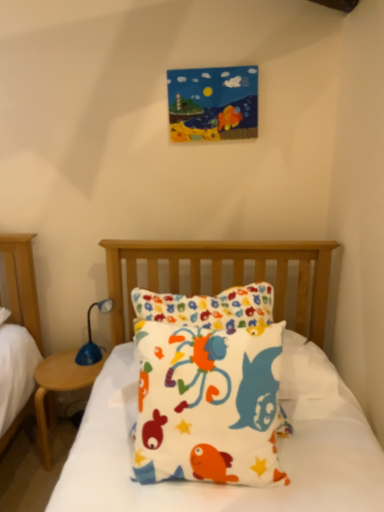
Find the location of a particular element. The width and height of the screenshot is (384, 512). blank space situated above wooden at left (from a real-world perspective) is located at coordinates (72, 367).